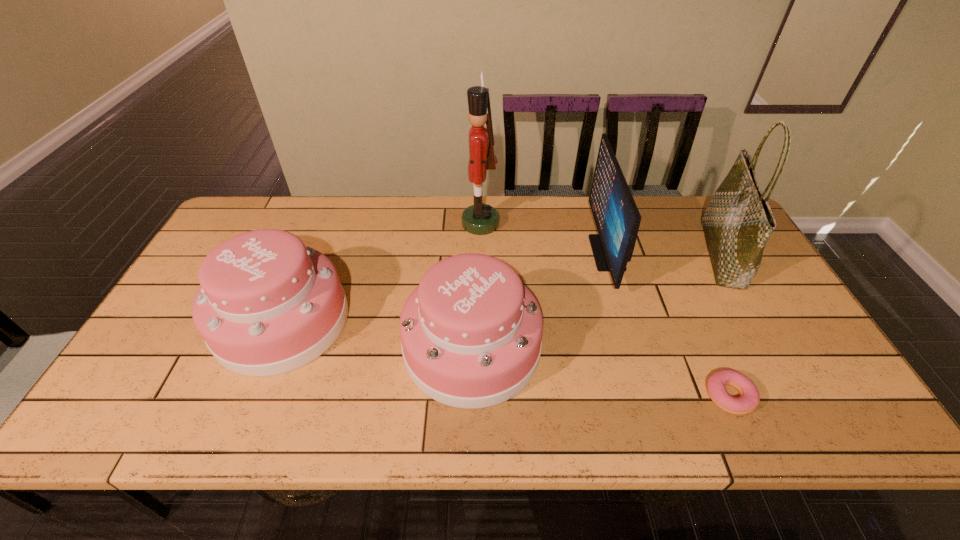
Find the location of a particular element. The height and width of the screenshot is (540, 960). free spot located 0.380m on the front-facing side of the nutcracker is located at coordinates (345, 224).

You are a GUI agent. You are given a task and a screenshot of the screen. Output one action in this format:
    pyautogui.click(x=<x>, y=<y>)
    Task: Click on the vacant area situated on the front of the shopping bag
    
    Given the screenshot: What is the action you would take?
    pyautogui.click(x=757, y=316)

This screenshot has height=540, width=960. I want to click on vacant space located 0.130m on the screen side of the computer monitor, so click(550, 253).

Where is `free spot located on the screen side of the computer monitor`? The width and height of the screenshot is (960, 540). free spot located on the screen side of the computer monitor is located at coordinates (566, 253).

Image resolution: width=960 pixels, height=540 pixels. What are the coordinates of `vacant point located on the screen side of the computer monitor` in the screenshot? It's located at (566, 253).

Image resolution: width=960 pixels, height=540 pixels. Find the location of `free space located on the back of the birthday cake`. free space located on the back of the birthday cake is located at coordinates (305, 264).

Find the location of a particular element. Image resolution: width=960 pixels, height=540 pixels. free space located on the back of the cake is located at coordinates (473, 245).

Locate an element on the screen. The height and width of the screenshot is (540, 960). blank area located on the right of the shortest object is located at coordinates (815, 396).

I want to click on nutcracker located in the far edge section of the desktop, so click(x=479, y=219).

Where is `shopping bag located in the far edge section of the desktop`? This screenshot has width=960, height=540. shopping bag located in the far edge section of the desktop is located at coordinates (738, 221).